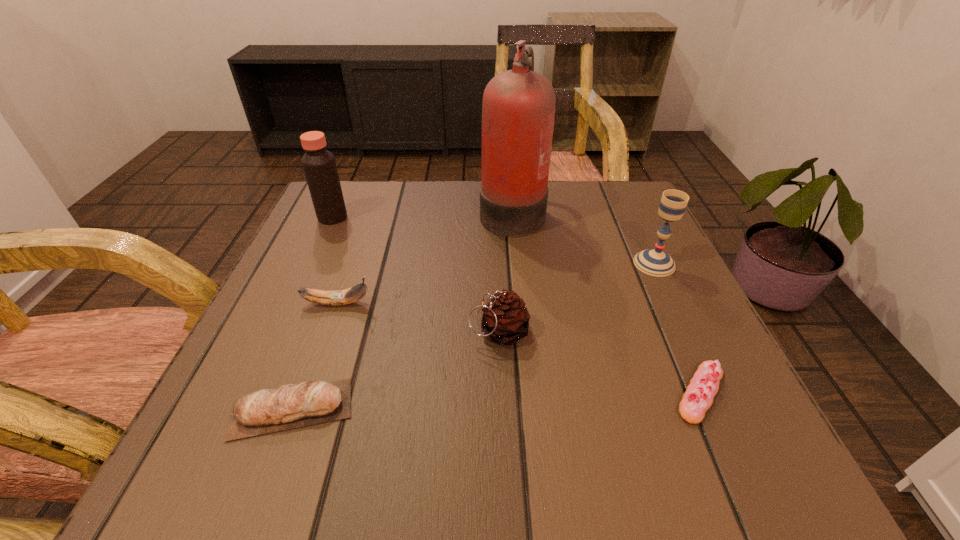
Find the location of `vacant space located 0.280m on the left of the shortest object`. vacant space located 0.280m on the left of the shortest object is located at coordinates (480, 393).

Locate an element on the screen. The height and width of the screenshot is (540, 960). fire extinguisher that is at the far edge is located at coordinates (518, 109).

Locate an element on the screen. vinegar situated at the far edge is located at coordinates (319, 165).

The width and height of the screenshot is (960, 540). I want to click on pita bread that is at the near edge, so [290, 406].

Find the location of a particular element. This screenshot has width=960, height=540. eclair present at the near edge is located at coordinates coord(698,398).

Image resolution: width=960 pixels, height=540 pixels. Find the location of `vinegar that is at the left edge`. vinegar that is at the left edge is located at coordinates (319, 165).

The image size is (960, 540). What are the coordinates of `banana situated at the left edge` in the screenshot? It's located at (339, 297).

Where is `pita bread positioned at the left edge`? The width and height of the screenshot is (960, 540). pita bread positioned at the left edge is located at coordinates (290, 406).

Find the location of a particular element. This screenshot has height=540, width=960. chalice positioned at the right edge is located at coordinates (655, 262).

At what (x,y) coordinates should I click in order to perform the action: click on eclair at the right edge. Please return your answer as a coordinate pair (x, y). The height and width of the screenshot is (540, 960). Looking at the image, I should click on (698, 398).